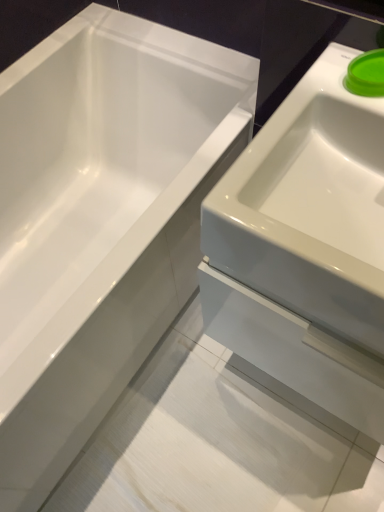
Question: From the image's perspective, is green plastic lid at upper right located above or below white glossy bathtub at upper left?

Choices:
 (A) below
 (B) above

Answer: (B)

Question: Is point (360, 67) closer or farther from the camera than point (92, 148)?

Choices:
 (A) closer
 (B) farther

Answer: (A)

Question: Which of these objects is positioned farthest from the white glossy sink at right?

Choices:
 (A) white glossy bathtub at upper left
 (B) green plastic lid at upper right

Answer: (A)

Question: Considering the real-world distances, which object is closest to the green plastic lid at upper right?

Choices:
 (A) white glossy sink at right
 (B) white glossy bathtub at upper left

Answer: (A)